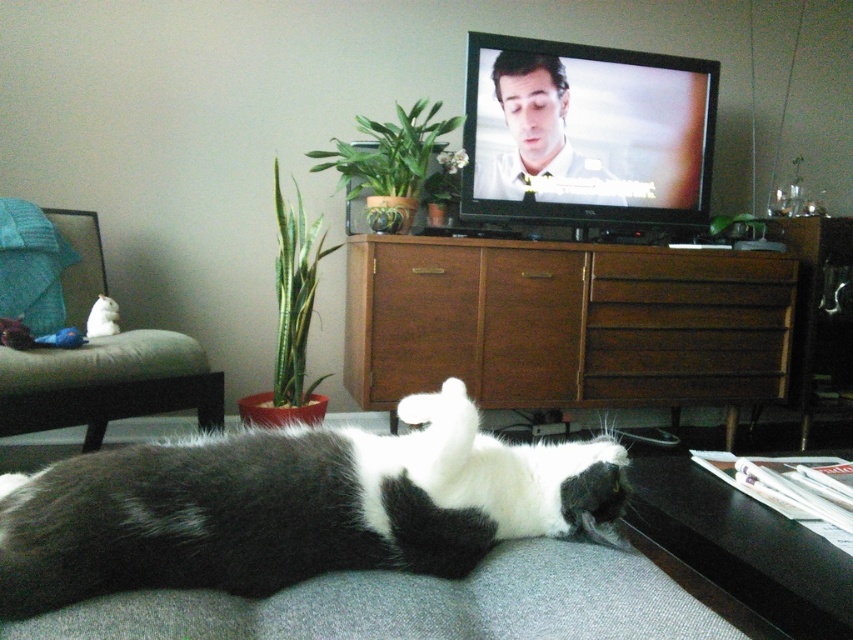
Who is lower down, black and white fur cat at lower center or brown wood dresser at center?

black and white fur cat at lower center is lower down.

Who is more distant from viewer, (318, 540) or (714, 353)?

Point (714, 353)

Image resolution: width=853 pixels, height=640 pixels. What do you see at coordinates (292, 506) in the screenshot? I see `black and white fur cat at lower center` at bounding box center [292, 506].

In order to click on black and white fur cat at lower center in this screenshot , I will do `click(292, 506)`.